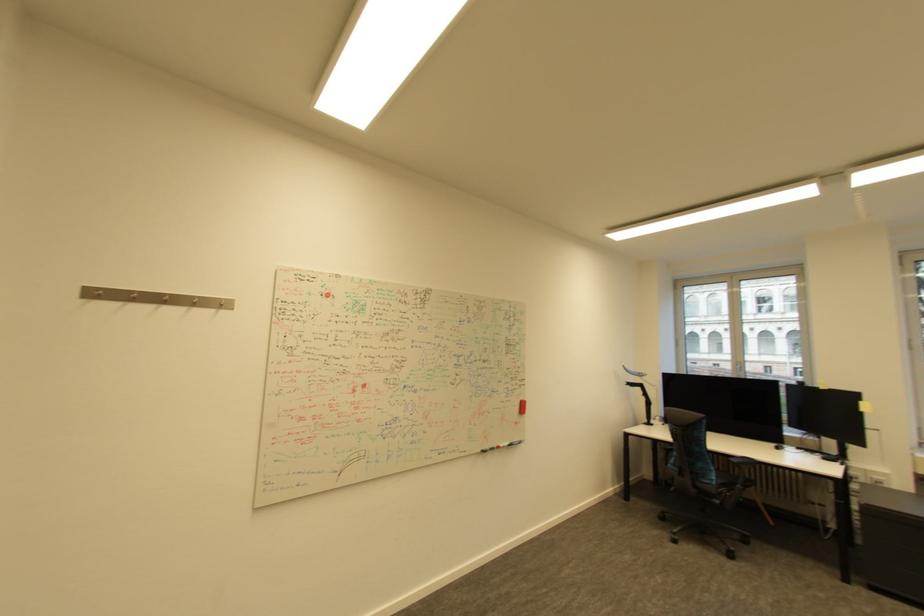
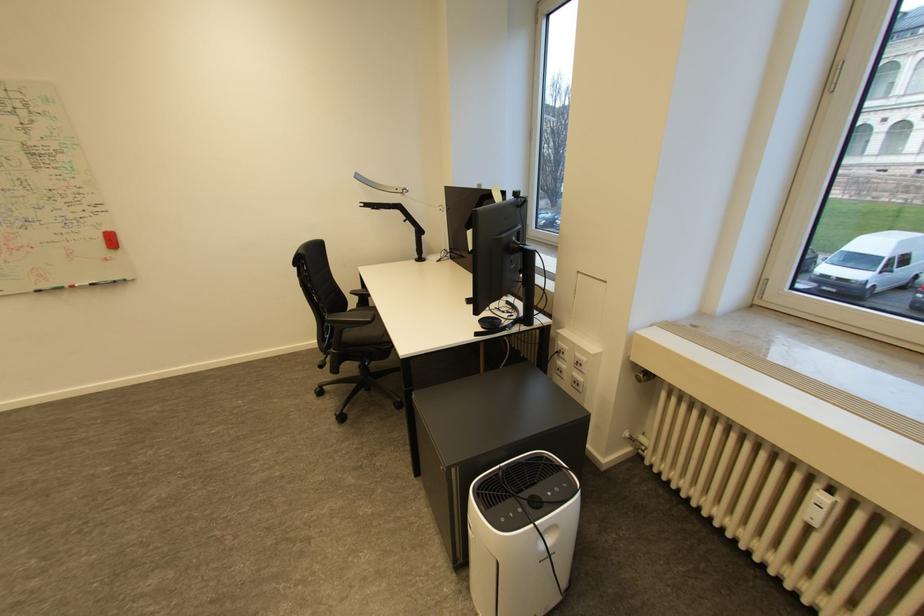
Find the pixel in the second image that matches point (646, 390) in the first image.

(405, 213)